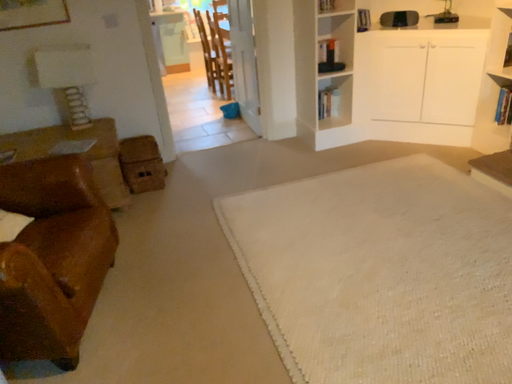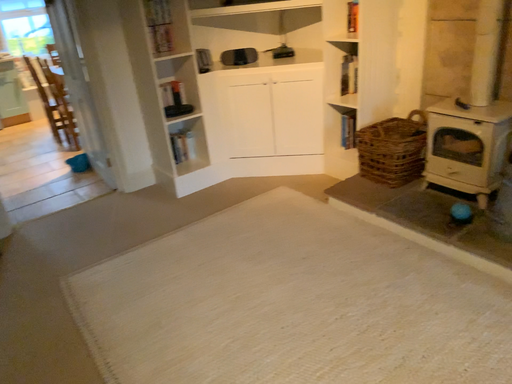
Question: Which way did the camera rotate in the video?

Choices:
 (A) rotated right
 (B) rotated left

Answer: (A)